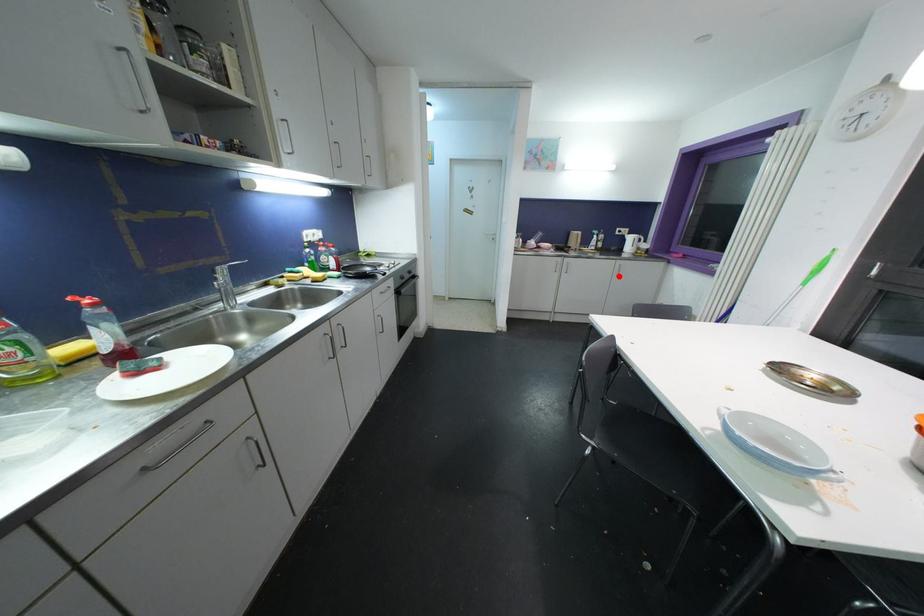
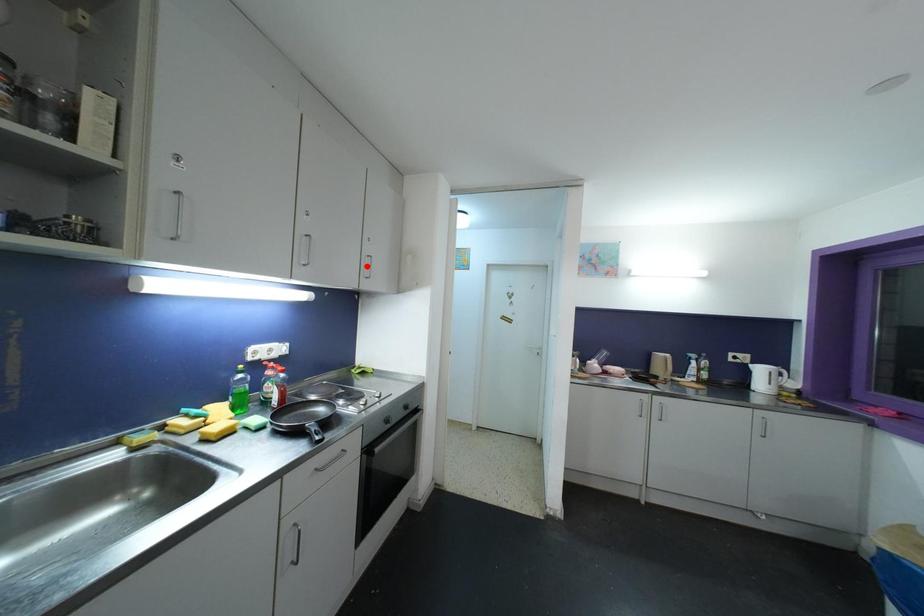
I am providing you with two images of the same scene from different viewpoints. A red point is marked on the first image and another point is marked on the second image. Do the highlighted points in image1 and image2 indicate the same real-world spot?

No